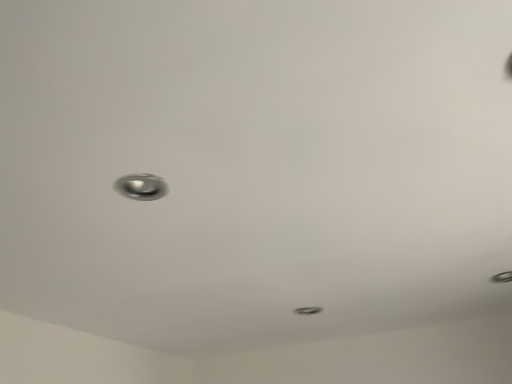
Question: Should I look upward or downward to see satin silver door handle at center?

Choices:
 (A) down
 (B) up

Answer: (A)